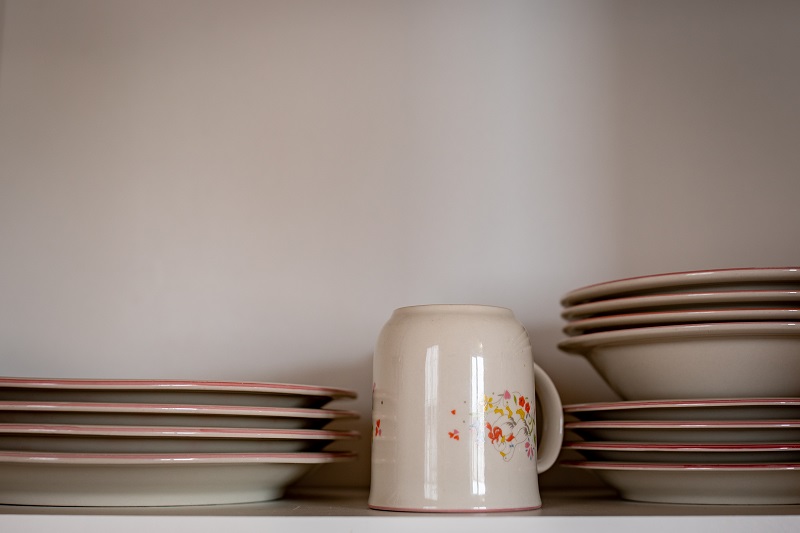
Identify the location of bowl. (678, 337), (660, 320), (674, 303), (696, 277).